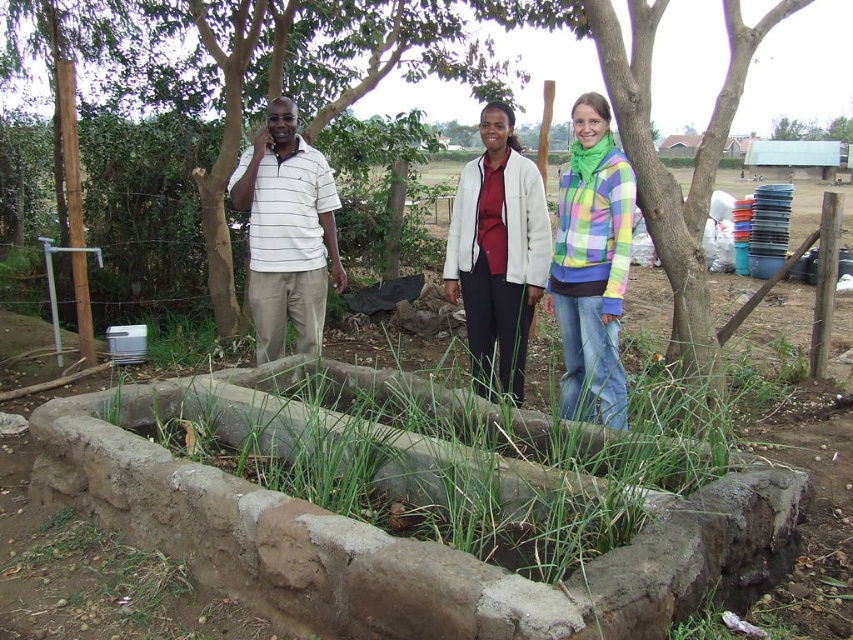
You are standing in the garden and want to hand a tool to both the white fleece jacket at center and the white striped polo shirt at left. Which person should you approach first to ensure you can reach them without moving?

You should approach the white fleece jacket at center first because it is closer to the viewer than the white striped polo shirt at left, making it easier to reach without moving.

You are a painter standing in front of the garden bed. You need to paint the multicolored plaid jacket at center and the brown bark tree at upper center. Which one will require you to look up more?

The brown bark tree at upper center requires looking up more because it is taller than the multicolored plaid jacket at center.

You are a photographer trying to capture a clear photo of the multicolored plaid jacket at center and the white fleece jacket at center. Which jacket is closer to the camera?

The multicolored plaid jacket at center is positioned under the white fleece jacket at center, so the white fleece jacket at center is closer to the camera.